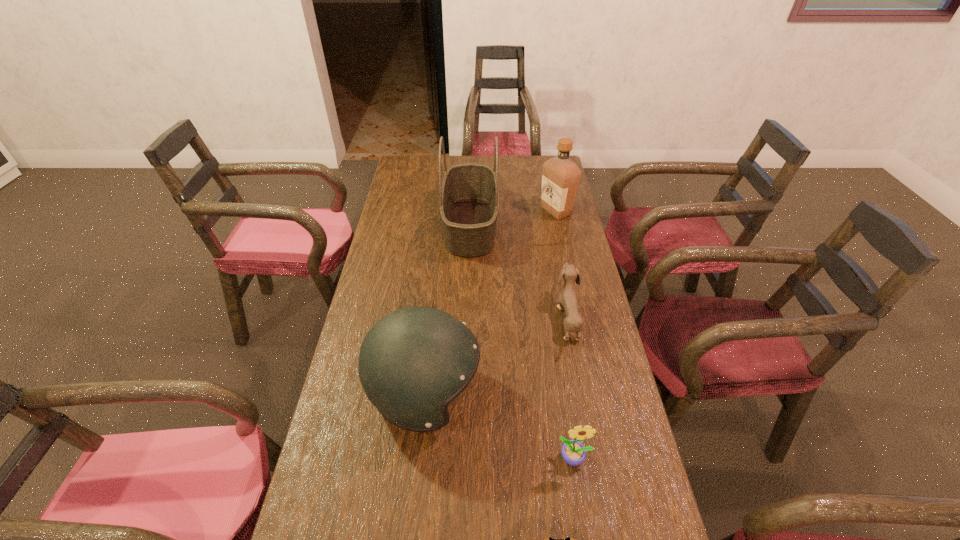
This screenshot has width=960, height=540. What are the coordinates of `basket` in the screenshot? It's located at (469, 197).

Find the location of `liquor`. liquor is located at coordinates (560, 175).

Find the location of a particular element. the third nearest object is located at coordinates (415, 361).

This screenshot has height=540, width=960. Identify the location of the second nearest object. tap(573, 452).

The image size is (960, 540). Find the location of `puppy`. puppy is located at coordinates (568, 299).

This screenshot has height=540, width=960. I want to click on free spot located 0.120m on the front of the basket, so click(468, 286).

Where is `free point located 0.250m on the front-facing side of the liquor`? free point located 0.250m on the front-facing side of the liquor is located at coordinates (476, 211).

The width and height of the screenshot is (960, 540). Find the location of `free location located 0.400m on the front-facing side of the liquor`. free location located 0.400m on the front-facing side of the liquor is located at coordinates (438, 211).

Image resolution: width=960 pixels, height=540 pixels. In order to click on free location located on the front-facing side of the liquor in this screenshot , I will do `click(506, 211)`.

The height and width of the screenshot is (540, 960). What are the coordinates of `vacant region located at the face opening of the football helmet` in the screenshot? It's located at (596, 395).